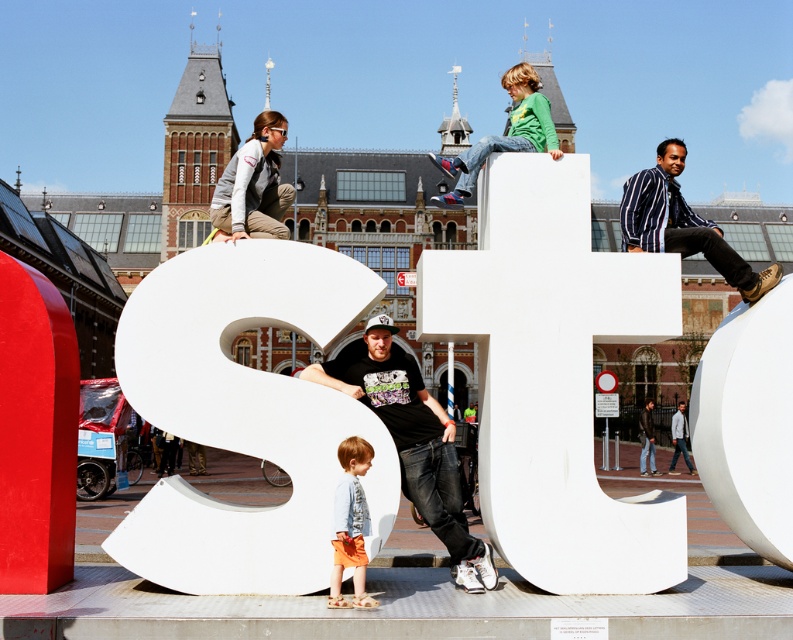
Is striped shirt at upper right below green jersey at upper center?

Indeed, striped shirt at upper right is positioned under green jersey at upper center.

Is point (713, 230) closer to viewer compared to point (451, 202)?

That is True.

Between point (646, 200) and point (534, 81), which one is positioned in front?

Point (534, 81) is more forward.

At what (x,y) coordinates should I click in order to perform the action: click on striped shirt at upper right. Please return your answer as a coordinate pair (x, y). Looking at the image, I should click on (682, 225).

Can you confirm if white matte letter t at upper center is thinner than striped shirt at upper right?

Correct, white matte letter t at upper center's width is less than striped shirt at upper right's.

Which is in front, point (646, 291) or point (665, 157)?

Point (646, 291) is in front.

At what (x,y) coordinates should I click in order to perform the action: click on white matte letter t at upper center. Please return your answer as a coordinate pair (x, y). Image resolution: width=793 pixels, height=640 pixels. Looking at the image, I should click on (554, 376).

This screenshot has height=640, width=793. What do you see at coordinates (682, 225) in the screenshot?
I see `striped shirt at upper right` at bounding box center [682, 225].

Which is in front, point (656, 173) or point (353, 481)?

Point (353, 481)

Does point (631, 243) come closer to viewer compared to point (343, 496)?

No, (631, 243) is behind (343, 496).

At what (x,y) coordinates should I click in order to perform the action: click on striped shirt at upper right. Please return your answer as a coordinate pair (x, y). This screenshot has width=793, height=640. Looking at the image, I should click on (682, 225).